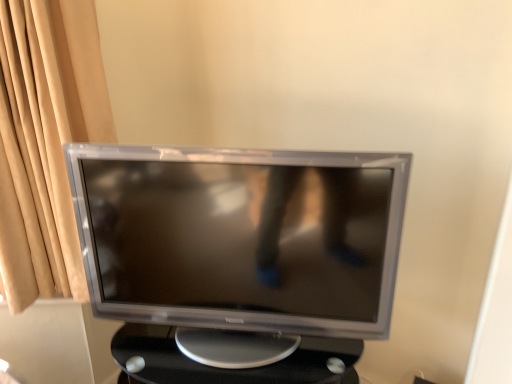
Question: In terms of size, does black plastic table at center appear bigger or smaller than satin silver monitor at center?

Choices:
 (A) small
 (B) big

Answer: (B)

Question: Looking at their shapes, would you say black plastic table at center is wider or thinner than satin silver monitor at center?

Choices:
 (A) wide
 (B) thin

Answer: (A)

Question: Would you say black plastic table at center is inside or outside satin silver monitor at center?

Choices:
 (A) inside
 (B) outside

Answer: (B)

Question: Based on their sizes in the image, would you say satin silver monitor at center is bigger or smaller than black plastic table at center?

Choices:
 (A) big
 (B) small

Answer: (B)

Question: Which is correct: satin silver monitor at center is inside black plastic table at center, or outside of it?

Choices:
 (A) inside
 (B) outside

Answer: (B)

Question: Relative to black plastic table at center, is satin silver monitor at center in front or behind?

Choices:
 (A) behind
 (B) front

Answer: (B)

Question: In terms of height, does satin silver monitor at center look taller or shorter compared to black plastic table at center?

Choices:
 (A) short
 (B) tall

Answer: (B)